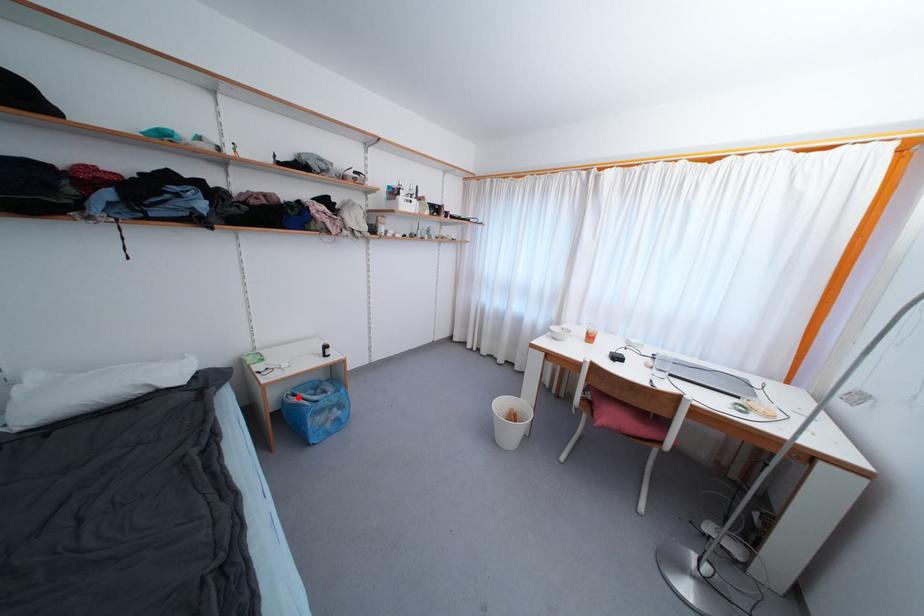
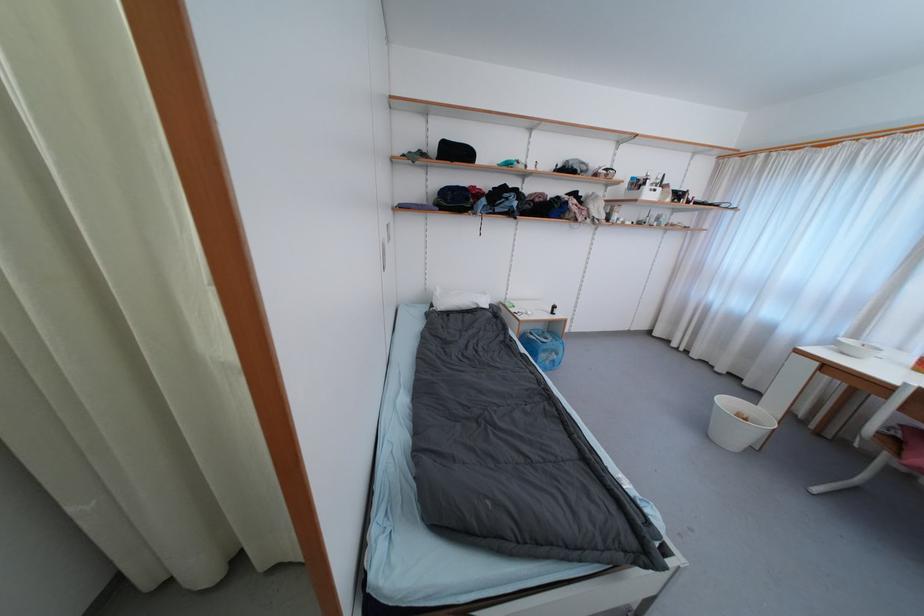
The point at the highlighted location is marked in the first image. Where is the corresponding point in the second image?

(535, 336)